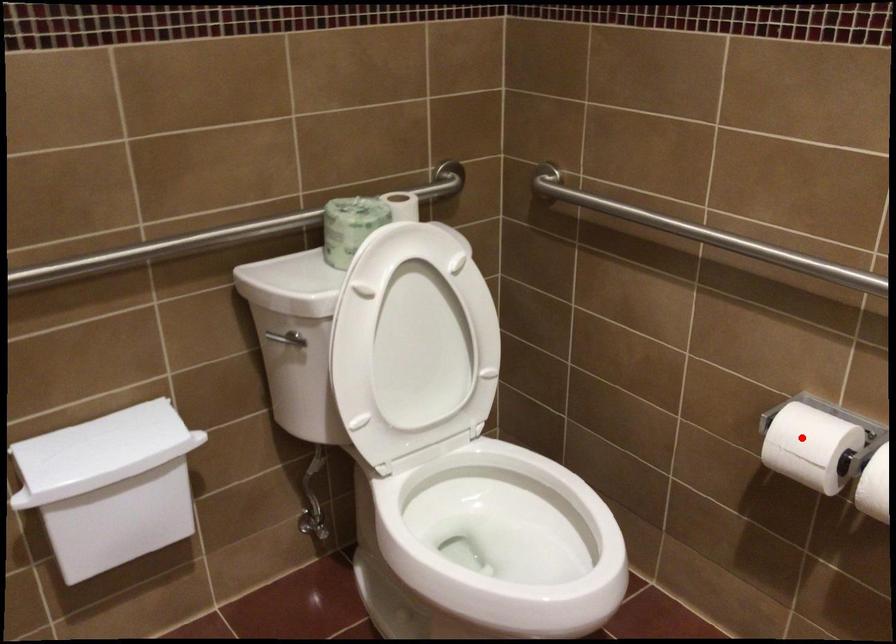
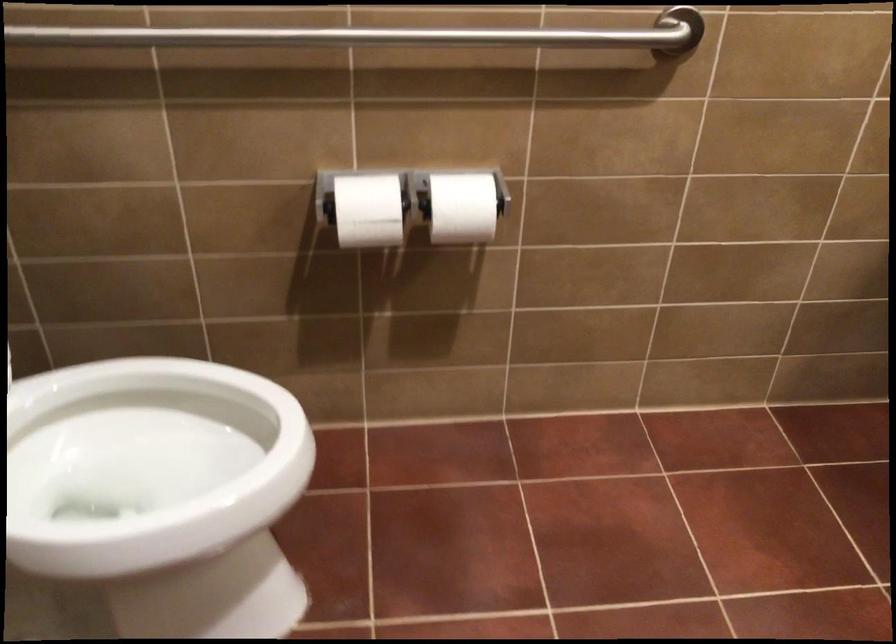
Locate, in the second image, the point that corresponds to the highlighted location in the first image.

(367, 210)